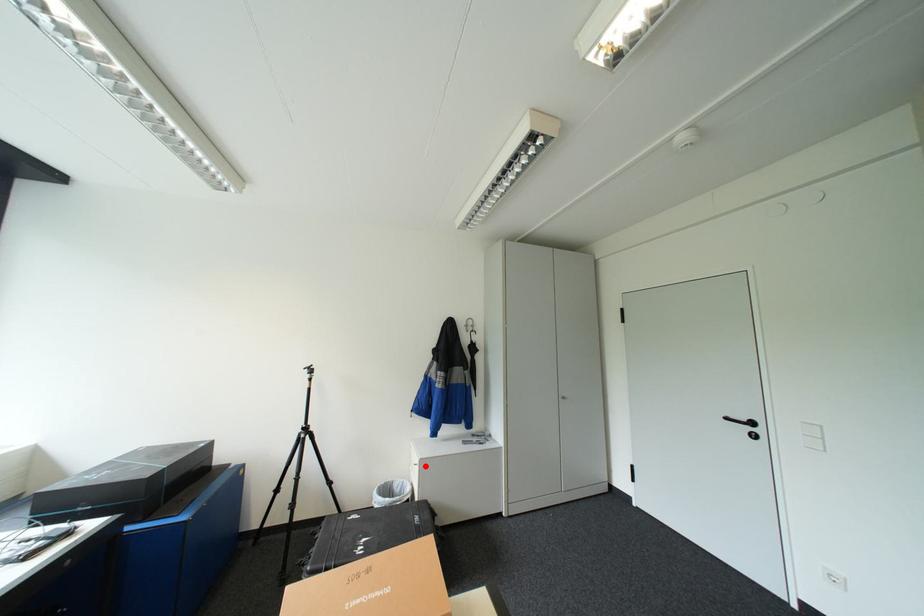
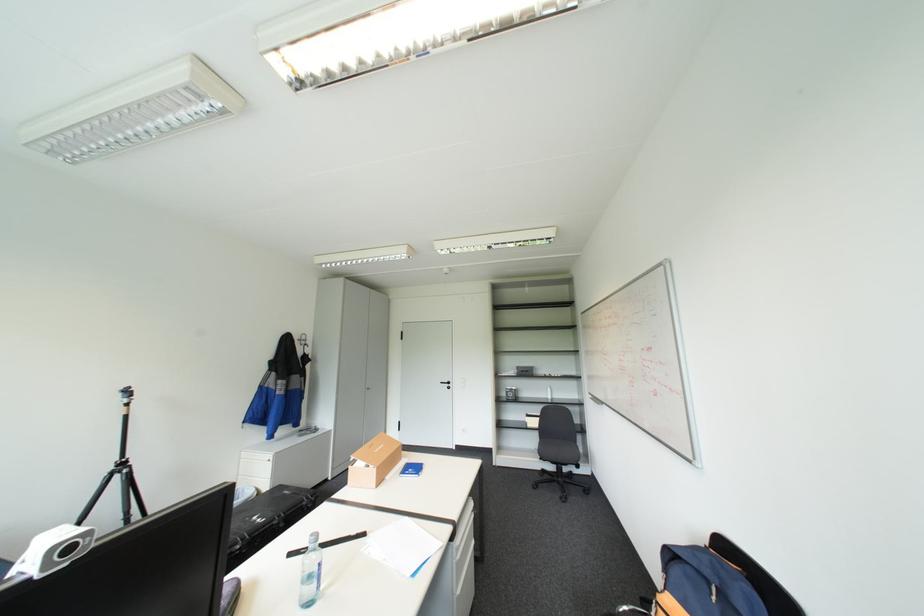
In the second image, find the point that corresponds to the highlighted location in the first image.

(278, 461)